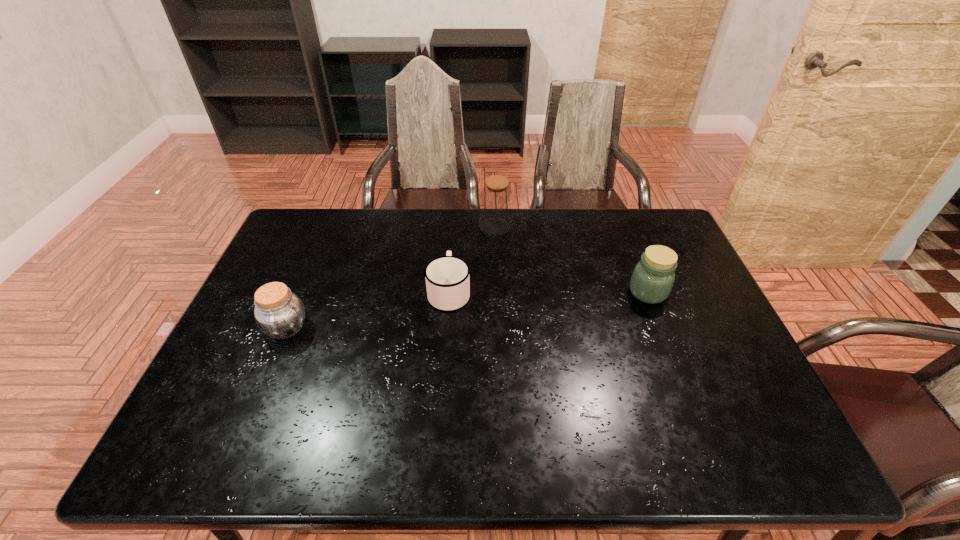
The width and height of the screenshot is (960, 540). I want to click on the second object from right to left, so click(496, 199).

This screenshot has width=960, height=540. Find the location of `the second jar from left to right`. the second jar from left to right is located at coordinates (496, 199).

At what (x,y) coordinates should I click in order to perform the action: click on the second nearest jar. Please return your answer as a coordinate pair (x, y). Image resolution: width=960 pixels, height=540 pixels. Looking at the image, I should click on (653, 277).

You are a GUI agent. You are given a task and a screenshot of the screen. Output one action in this format:
    pyautogui.click(x=<x>, y=<y>)
    Task: Click on the rightmost object
    
    Given the screenshot: What is the action you would take?
    pyautogui.click(x=653, y=277)

Locate an element on the screen. The width and height of the screenshot is (960, 540). the leftmost jar is located at coordinates (279, 313).

Locate an element on the screen. The height and width of the screenshot is (540, 960). the leftmost object is located at coordinates tap(279, 313).

Locate an element on the screen. Image resolution: width=960 pixels, height=540 pixels. the shortest object is located at coordinates (447, 277).

At what (x,y) coordinates should I click in order to perform the action: click on mug. Please return your answer as a coordinate pair (x, y). The height and width of the screenshot is (540, 960). Looking at the image, I should click on (447, 277).

Locate an element on the screen. The width and height of the screenshot is (960, 540). vacant space located on the left of the second object from right to left is located at coordinates (366, 226).

Where is `free space located 0.190m on the front of the second farthest jar`? The height and width of the screenshot is (540, 960). free space located 0.190m on the front of the second farthest jar is located at coordinates (675, 361).